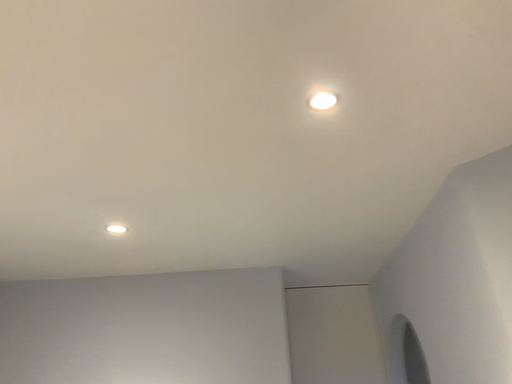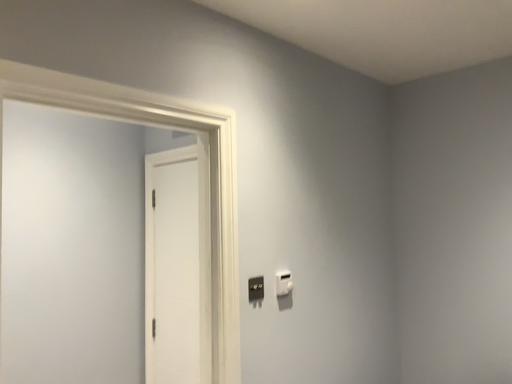
Question: How did the camera likely rotate when shooting the video?

Choices:
 (A) rotated downward
 (B) rotated upward

Answer: (A)